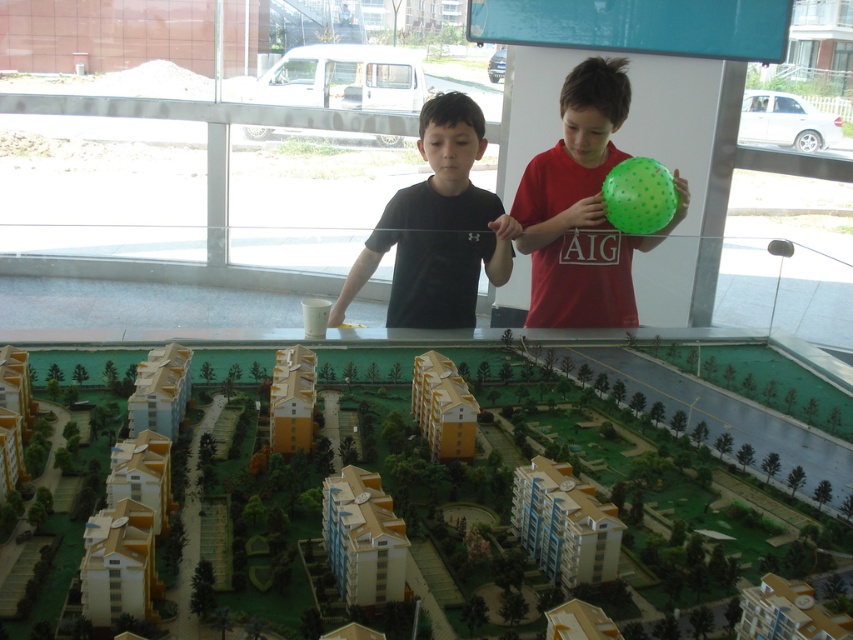
Can you confirm if green dotted balloon at center is shorter than black matte shirt at center?

In fact, green dotted balloon at center may be taller than black matte shirt at center.

Describe the element at coordinates (582, 209) in the screenshot. This screenshot has width=853, height=640. I see `green dotted balloon at center` at that location.

Is point (537, 250) closer to camera compared to point (442, 253)?

No, it is not.

Where is `green dotted balloon at center`? green dotted balloon at center is located at coordinates (582, 209).